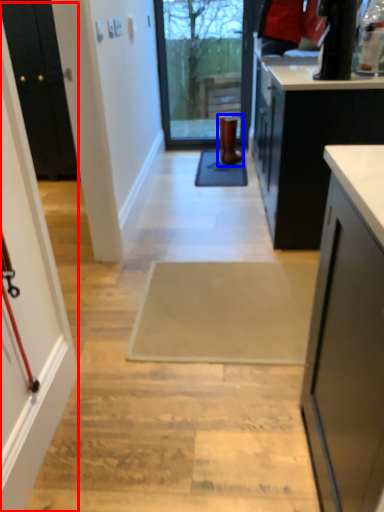
Question: Which of the following is the farthest to the observer, screen door (highlighted by a red box) or footwear (highlighted by a blue box)?

Choices:
 (A) screen door
 (B) footwear

Answer: (B)